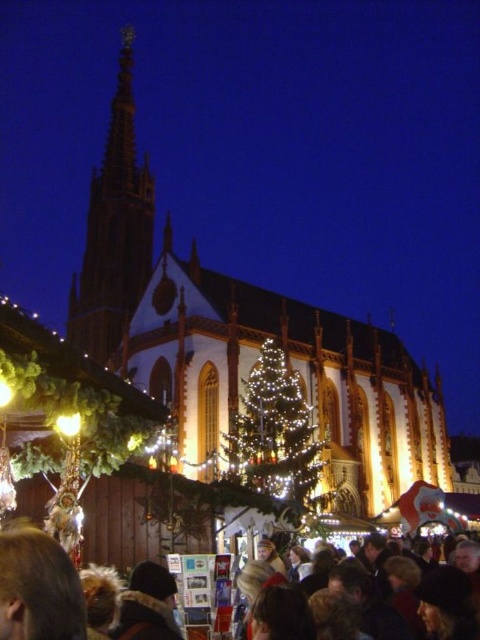
Question: Which point is closer to the camera?

Choices:
 (A) shiny gold spire at upper left
 (B) fur-lined coat at lower center
 (C) white stone church at center

Answer: (B)

Question: Which point appears closest to the camera in this image?

Choices:
 (A) (396, 557)
 (B) (421, 429)

Answer: (A)

Question: Can you confirm if white stone church at center is thinner than fur-lined coat at lower center?

Choices:
 (A) yes
 (B) no

Answer: (B)

Question: Which object is positioned closest to the illuminated glass christmas tree at center?

Choices:
 (A) dark brown hair at lower center
 (B) white stone church at center

Answer: (B)

Question: Is white stone church at center closer to the viewer compared to fur-lined coat at lower center?

Choices:
 (A) yes
 (B) no

Answer: (B)

Question: Considering the relative positions of fur-lined coat at lower center and dark brown hair at lower center in the image provided, where is fur-lined coat at lower center located with respect to dark brown hair at lower center?

Choices:
 (A) above
 (B) below

Answer: (A)